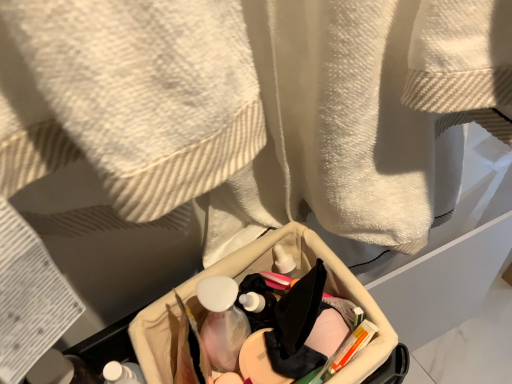
Question: Considering the relative sizes of translucent plastic mouthwash at center and beige fabric basket at center in the image provided, is translucent plastic mouthwash at center wider than beige fabric basket at center?

Choices:
 (A) yes
 (B) no

Answer: (B)

Question: From a real-world perspective, is translucent plastic mouthwash at center physically above beige fabric basket at center?

Choices:
 (A) no
 (B) yes

Answer: (A)

Question: Is translucent plastic mouthwash at center at the left side of beige fabric basket at center?

Choices:
 (A) yes
 (B) no

Answer: (A)

Question: Is translucent plastic mouthwash at center turned away from beige fabric basket at center?

Choices:
 (A) yes
 (B) no

Answer: (A)

Question: Considering the relative sizes of translucent plastic mouthwash at center and beige fabric basket at center in the image provided, is translucent plastic mouthwash at center thinner than beige fabric basket at center?

Choices:
 (A) yes
 (B) no

Answer: (A)

Question: Does translucent plastic mouthwash at center come behind beige fabric basket at center?

Choices:
 (A) yes
 (B) no

Answer: (A)

Question: Considering the relative sizes of white matte bottle at lower left and translucent plastic mouthwash at center in the image provided, is white matte bottle at lower left thinner than translucent plastic mouthwash at center?

Choices:
 (A) yes
 (B) no

Answer: (B)

Question: Considering the relative sizes of white matte bottle at lower left and translucent plastic mouthwash at center in the image provided, is white matte bottle at lower left taller than translucent plastic mouthwash at center?

Choices:
 (A) yes
 (B) no

Answer: (A)

Question: From the image's perspective, is white matte bottle at lower left beneath translucent plastic mouthwash at center?

Choices:
 (A) no
 (B) yes

Answer: (B)

Question: From a real-world perspective, does white matte bottle at lower left stand above translucent plastic mouthwash at center?

Choices:
 (A) yes
 (B) no

Answer: (A)

Question: Can you confirm if white matte bottle at lower left is shorter than translucent plastic mouthwash at center?

Choices:
 (A) no
 (B) yes

Answer: (A)

Question: Does white matte bottle at lower left contain translucent plastic mouthwash at center?

Choices:
 (A) no
 (B) yes

Answer: (A)

Question: Considering the relative positions of translucent plastic mouthwash at center and white matte bottle at lower left in the image provided, is translucent plastic mouthwash at center in front of white matte bottle at lower left?

Choices:
 (A) yes
 (B) no

Answer: (B)